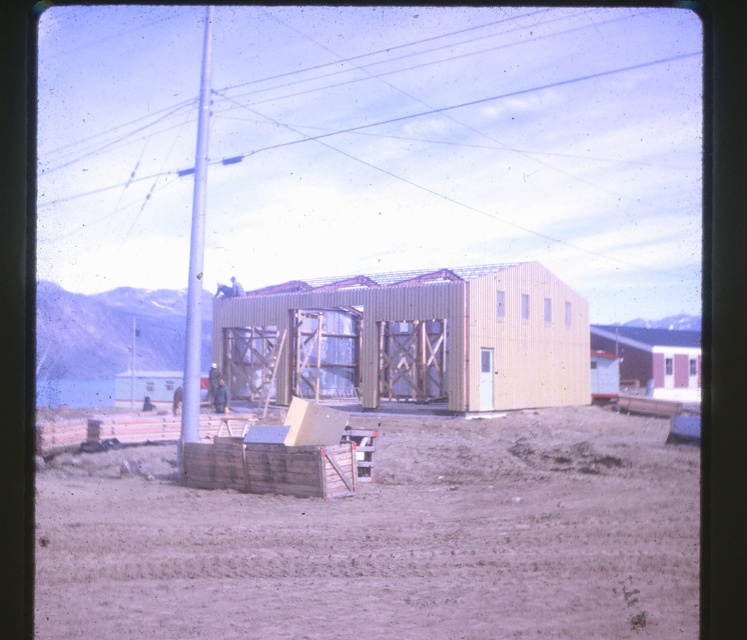
What do you see at coordinates (385, 538) in the screenshot?
I see `brown sandy dirt at lower center` at bounding box center [385, 538].

The width and height of the screenshot is (747, 640). What do you see at coordinates (385, 538) in the screenshot? I see `brown sandy dirt at lower center` at bounding box center [385, 538].

Where is `brown sandy dirt at lower center`? The image size is (747, 640). brown sandy dirt at lower center is located at coordinates (385, 538).

Between wooden cabin at center and metallic pole at center-left, which one is positioned lower?

Positioned lower is wooden cabin at center.

The height and width of the screenshot is (640, 747). What are the coordinates of `wooden cabin at center` in the screenshot? It's located at (409, 339).

Who is more distant from viewer, (421, 291) or (210, 19)?

Point (210, 19)

The image size is (747, 640). In order to click on wooden cabin at center in this screenshot , I will do `click(409, 339)`.

Can you confirm if brown sandy dirt at lower center is shorter than light brown corrugated metal hut at center?

Indeed, brown sandy dirt at lower center has a lesser height compared to light brown corrugated metal hut at center.

Between brown sandy dirt at lower center and light brown corrugated metal hut at center, which one is positioned lower?

Positioned lower is brown sandy dirt at lower center.

The height and width of the screenshot is (640, 747). Describe the element at coordinates (385, 538) in the screenshot. I see `brown sandy dirt at lower center` at that location.

You are a GUI agent. You are given a task and a screenshot of the screen. Output one action in this format:
    pyautogui.click(x=<x>, y=<y>)
    Task: Click on the brown sandy dirt at lower center
    This screenshot has height=640, width=747.
    Given the screenshot: What is the action you would take?
    pyautogui.click(x=385, y=538)